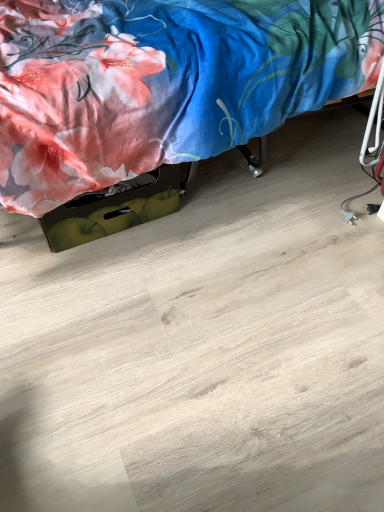
The image size is (384, 512). Describe the element at coordinates (163, 83) in the screenshot. I see `floral satin bed at upper left` at that location.

The image size is (384, 512). What are the coordinates of `floral satin bed at upper left` in the screenshot? It's located at (163, 83).

I want to click on floral satin bed at upper left, so click(x=163, y=83).